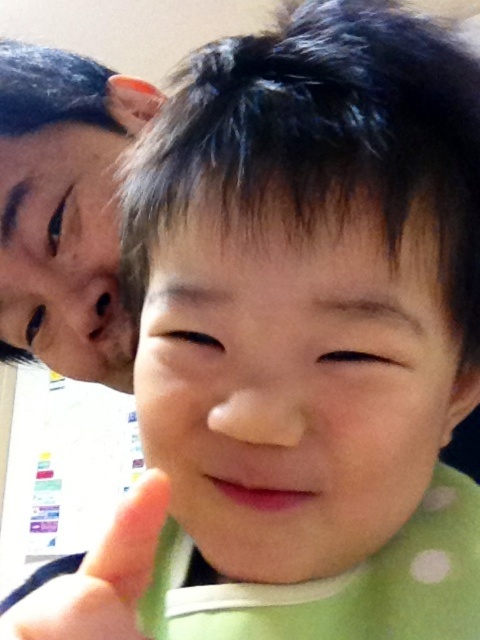
Question: Is the position of matte black hair at upper left less distant than that of pink matte mouth at center?

Choices:
 (A) no
 (B) yes

Answer: (A)

Question: Does matte black hair at upper left have a smaller size compared to pink matte mouth at center?

Choices:
 (A) yes
 (B) no

Answer: (B)

Question: Which point is closer to the camera taking this photo?

Choices:
 (A) (229, 497)
 (B) (109, 141)

Answer: (A)

Question: Is matte black hair at upper left thinner than pink matte mouth at center?

Choices:
 (A) no
 (B) yes

Answer: (A)

Question: Among these objects, which one is farthest from the camera?

Choices:
 (A) pink matte mouth at center
 (B) matte black hair at upper left

Answer: (B)